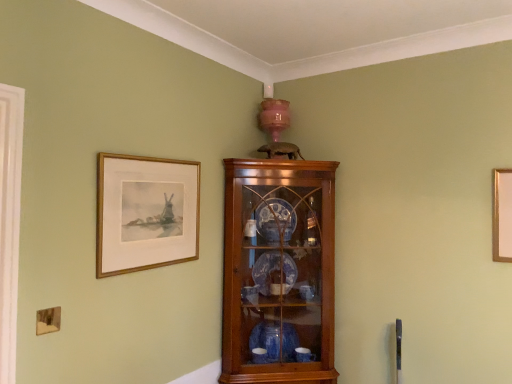
Question: Do you think wooden cabinet at upper center is within wooden framed print at upper left, or outside of it?

Choices:
 (A) outside
 (B) inside

Answer: (A)

Question: From their relative heights in the image, would you say wooden cabinet at upper center is taller or shorter than wooden framed print at upper left?

Choices:
 (A) short
 (B) tall

Answer: (B)

Question: From the image's perspective, is wooden cabinet at upper center located above or below wooden framed print at upper left?

Choices:
 (A) above
 (B) below

Answer: (B)

Question: From their relative heights in the image, would you say wooden framed print at upper left is taller or shorter than wooden cabinet at upper center?

Choices:
 (A) short
 (B) tall

Answer: (A)

Question: From a real-world perspective, relative to wooden cabinet at upper center, is wooden framed print at upper left vertically above or below?

Choices:
 (A) below
 (B) above

Answer: (B)

Question: Which is correct: wooden framed print at upper left is inside wooden cabinet at upper center, or outside of it?

Choices:
 (A) outside
 (B) inside

Answer: (A)

Question: In terms of size, does wooden framed print at upper left appear bigger or smaller than wooden cabinet at upper center?

Choices:
 (A) big
 (B) small

Answer: (B)